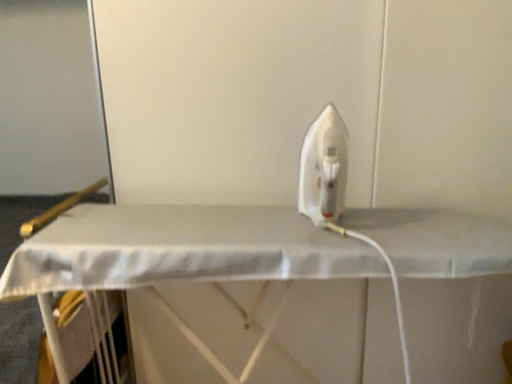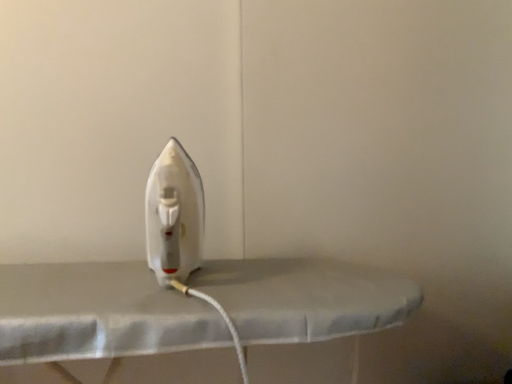
Question: Which way did the camera rotate in the video?

Choices:
 (A) rotated left
 (B) rotated right

Answer: (B)